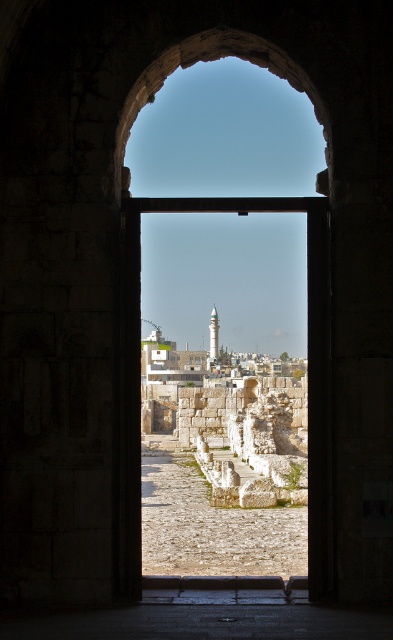
You are standing in front of the arched doorway and want to take a photo of both point (312, 484) and point (214, 328). Which point should you focus on first to ensure both are in sharp focus?

You should focus on point (312, 484) first because it is closer to the camera than point (214, 328). By focusing on the closer point, the farther point will also be within the depth of field and in focus.

You are standing in front of the stone archway at center. If you want to walk through it to reach the courtyard beyond, in which direction should you move relative to the archway?

To walk through the stone archway at center, you should move forward towards the courtyard, as the archway is positioned at the entrance leading into the sunlit courtyard beyond the doorway.

You are standing in the courtyard and want to take a photo of the stone archway at center and the white marble minaret at center. Which object should you frame first in your camera to capture both in the same shot?

The stone archway at center is positioned on the right side of the white marble minaret at center, so you should frame the white marble minaret at center first on the left to include both in the shot.